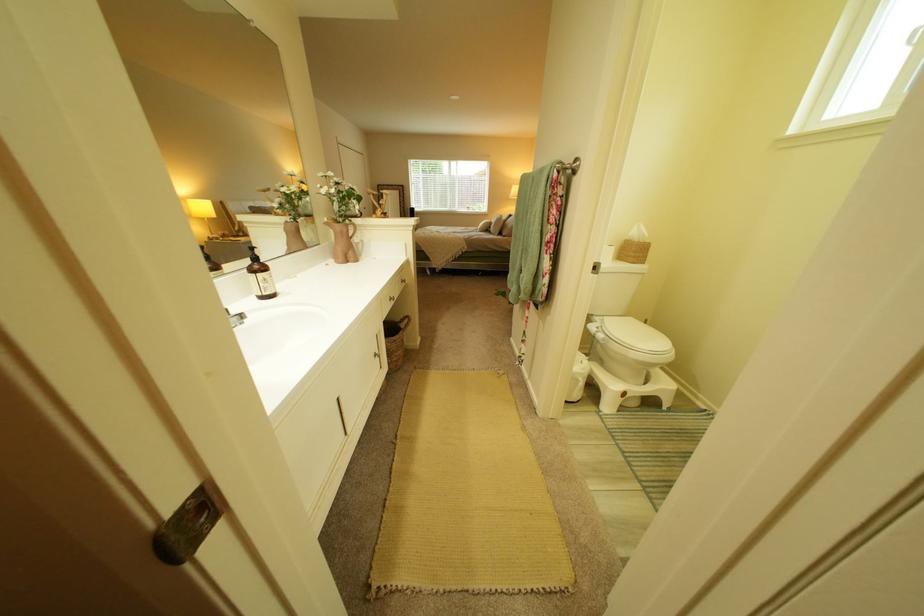
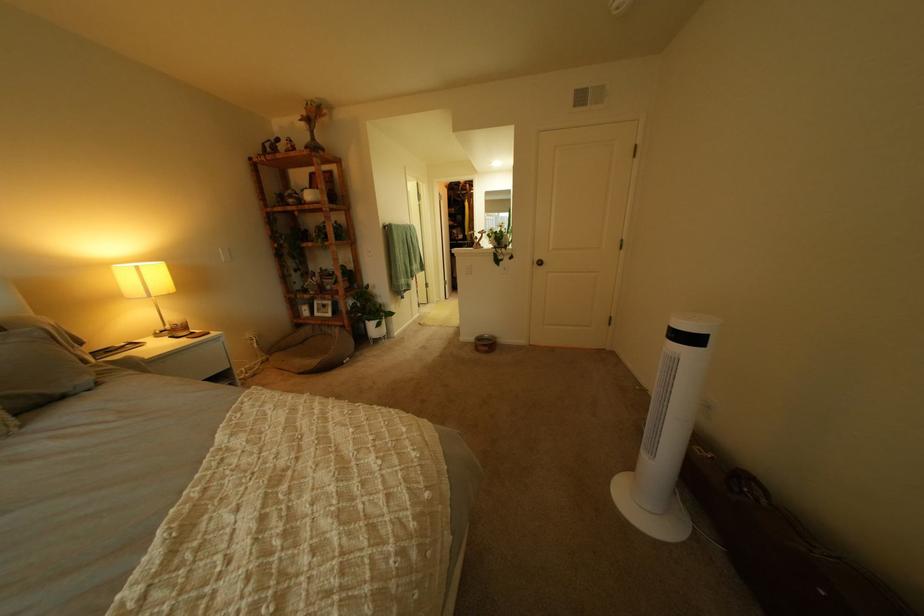
The point at (519, 238) is marked in the first image. Where is the corresponding point in the second image?

(115, 385)